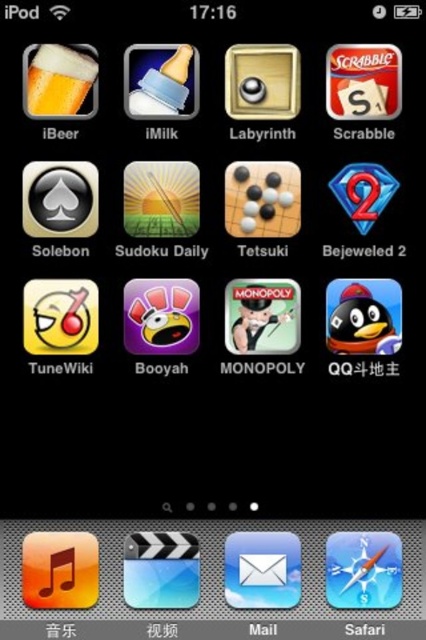
Question: Does white glossy envelope at center have a greater width compared to matte glass beer at upper left?

Choices:
 (A) yes
 (B) no

Answer: (A)

Question: Which object appears farthest from the camera in this image?

Choices:
 (A) matte glass beer at upper left
 (B) white glossy envelope at center

Answer: (B)

Question: Is white glossy envelope at center positioned before matte glass beer at upper left?

Choices:
 (A) yes
 (B) no

Answer: (B)

Question: Is white glossy envelope at center further to the viewer compared to matte glass beer at upper left?

Choices:
 (A) no
 (B) yes

Answer: (B)

Question: Which object is closer to the camera taking this photo?

Choices:
 (A) matte glass beer at upper left
 (B) white glossy envelope at center

Answer: (A)